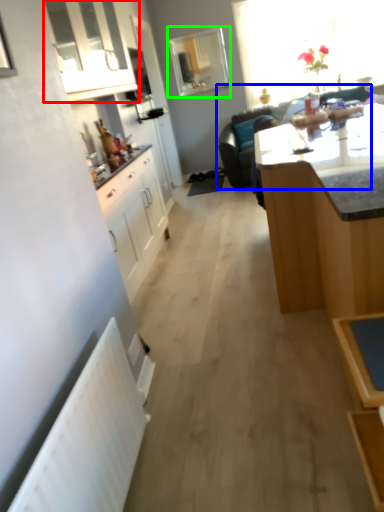
Question: Which object is positioned closest to cabinetry (highlighted by a red box)? Select from studio couch (highlighted by a blue box) and window (highlighted by a green box).

Choices:
 (A) studio couch
 (B) window

Answer: (A)